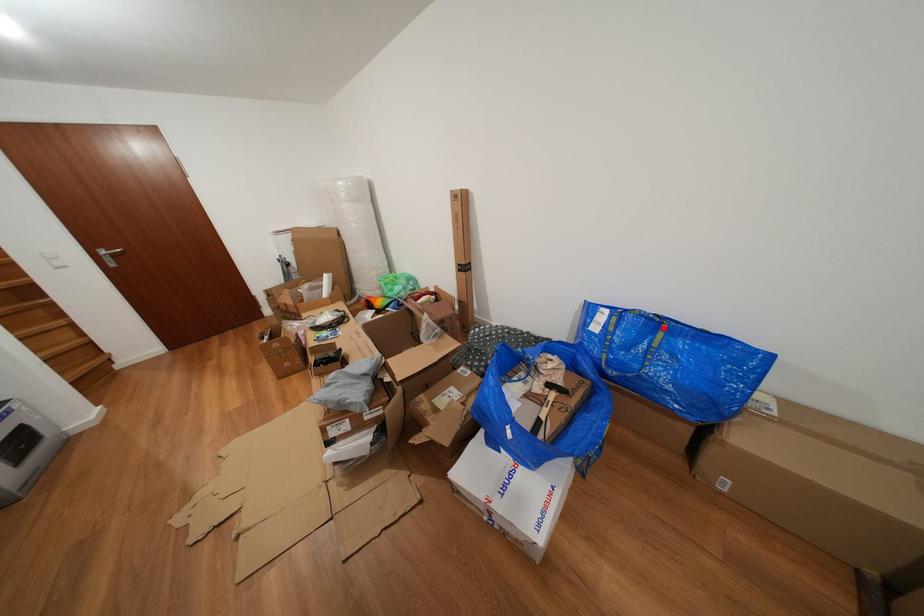
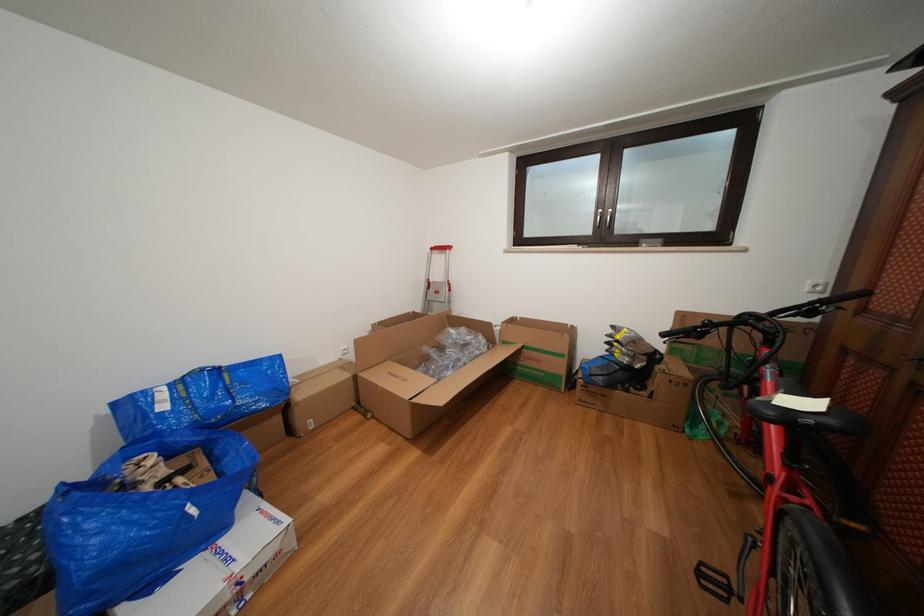
Find the pixel in the second image that matches the highlighted location in the first image.

(225, 376)